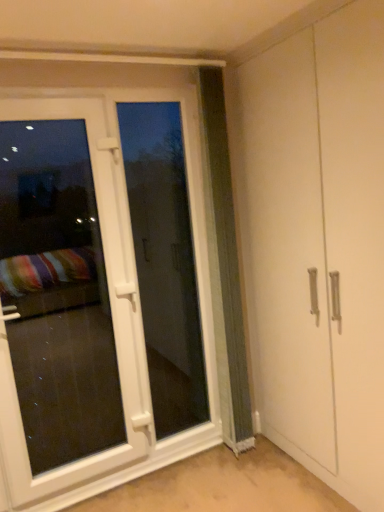
Question: Would you say white plastic screen door at left is a long distance from green textured curtain at center?

Choices:
 (A) yes
 (B) no

Answer: (B)

Question: Is white plastic screen door at left taller than green textured curtain at center?

Choices:
 (A) yes
 (B) no

Answer: (B)

Question: Can you confirm if white plastic screen door at left is thinner than green textured curtain at center?

Choices:
 (A) yes
 (B) no

Answer: (A)

Question: From the image's perspective, would you say white plastic screen door at left is positioned over green textured curtain at center?

Choices:
 (A) no
 (B) yes

Answer: (A)

Question: Can you confirm if white plastic screen door at left is positioned to the right of green textured curtain at center?

Choices:
 (A) yes
 (B) no

Answer: (B)

Question: Does white plastic screen door at left turn towards green textured curtain at center?

Choices:
 (A) yes
 (B) no

Answer: (B)

Question: Considering the relative sizes of white glossy door at left and green textured curtain at center in the image provided, is white glossy door at left shorter than green textured curtain at center?

Choices:
 (A) yes
 (B) no

Answer: (A)

Question: From the image's perspective, is white glossy door at left under green textured curtain at center?

Choices:
 (A) no
 (B) yes

Answer: (B)

Question: Is white glossy door at left oriented away from green textured curtain at center?

Choices:
 (A) no
 (B) yes

Answer: (A)

Question: Is white glossy door at left positioned before green textured curtain at center?

Choices:
 (A) yes
 (B) no

Answer: (A)

Question: From the image's perspective, would you say white glossy door at left is positioned over green textured curtain at center?

Choices:
 (A) no
 (B) yes

Answer: (A)

Question: Does white glossy door at left touch green textured curtain at center?

Choices:
 (A) no
 (B) yes

Answer: (A)

Question: Is green textured curtain at center next to white glossy door at left and touching it?

Choices:
 (A) yes
 (B) no

Answer: (B)